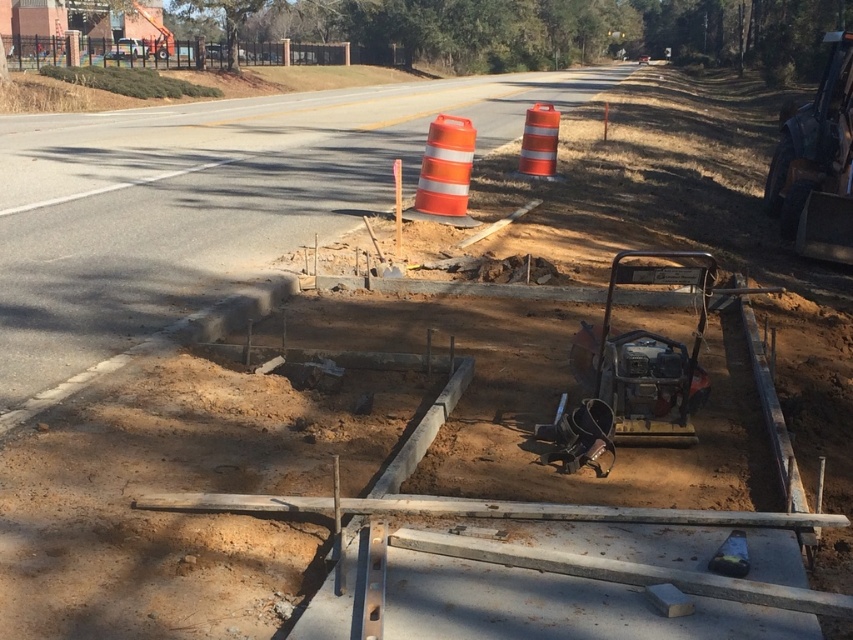
The height and width of the screenshot is (640, 853). What do you see at coordinates (817, 163) in the screenshot?
I see `orange/reflective plastic construction vehicle at upper right` at bounding box center [817, 163].

At what (x,y) coordinates should I click in order to perform the action: click on orange/reflective plastic construction vehicle at upper right. Please return your answer as a coordinate pair (x, y). The height and width of the screenshot is (640, 853). Looking at the image, I should click on (817, 163).

Does point (781, 184) come behind point (556, 122)?

No, it is in front of (556, 122).

Identify the location of orange/reflective plastic construction vehicle at upper right. (817, 163).

Who is positioned more to the left, orange reflective cone at center or orange reflective cone at upper center?

orange reflective cone at center

Which is in front, point (473, 141) or point (538, 102)?

Positioned in front is point (473, 141).

Find the location of a particular element. This screenshot has height=640, width=853. orange reflective cone at center is located at coordinates click(x=445, y=168).

This screenshot has width=853, height=640. Identify the location of orange/reflective plastic construction vehicle at upper right. (817, 163).

Who is more forward, (807, 250) or (439, 144)?

Point (807, 250) is more forward.

Between point (764, 193) and point (461, 122), which one is positioned behind?

The point (764, 193) is behind.

I want to click on orange/reflective plastic construction vehicle at upper right, so click(x=817, y=163).